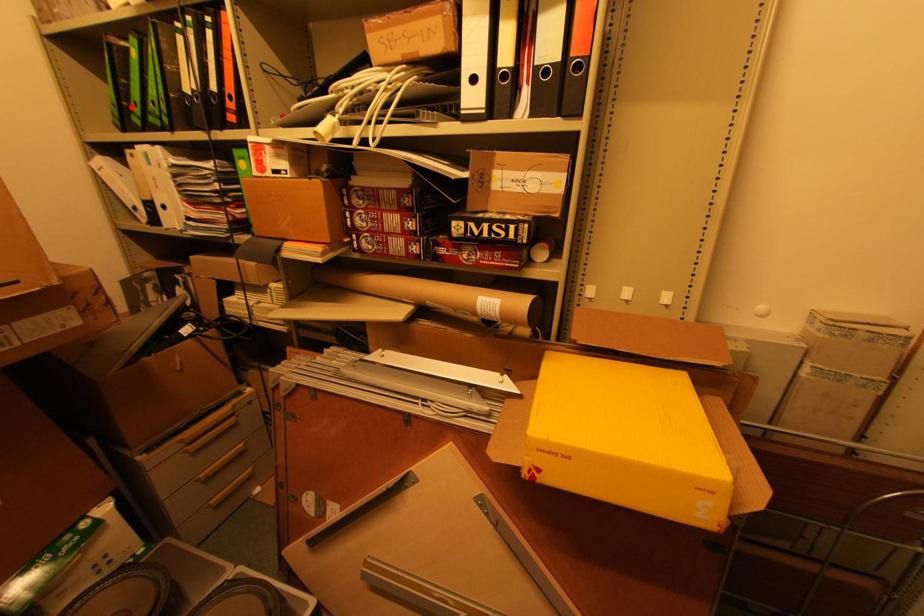
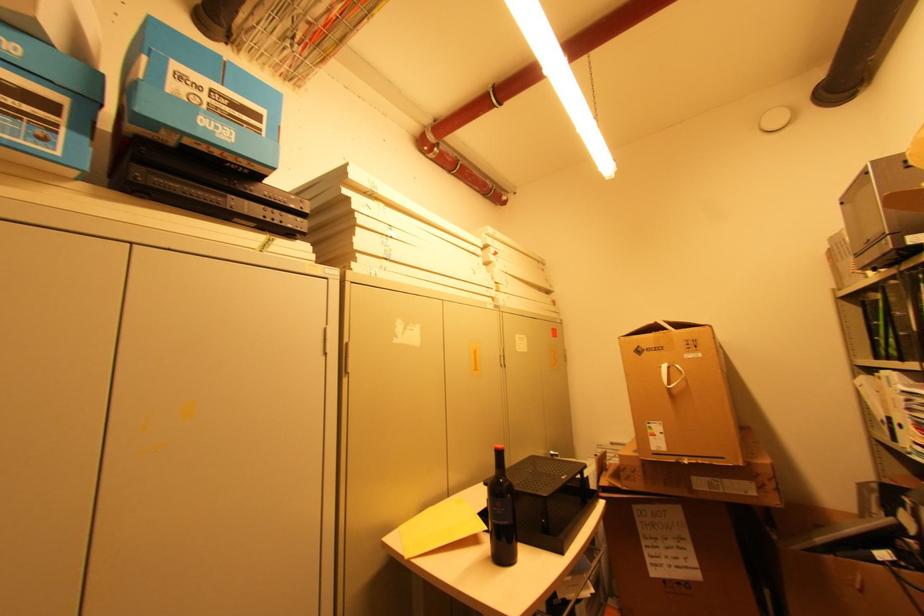
Find the pixel in the second image that matches the highlighted location in the first image.

(881, 341)